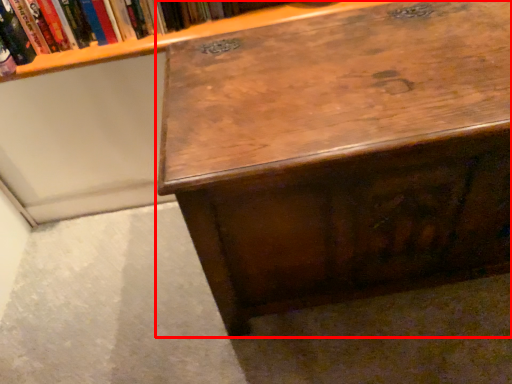
Question: From the image's perspective, what is the correct spatial relationship of desk (annotated by the red box) in relation to book?

Choices:
 (A) below
 (B) above

Answer: (A)